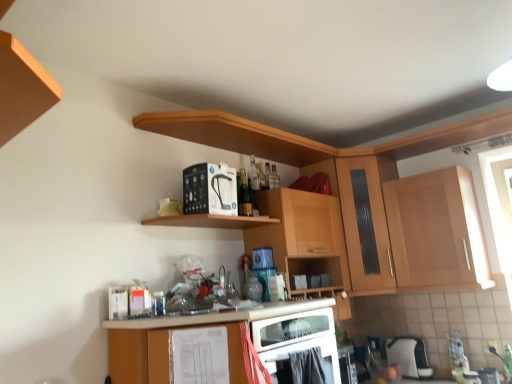
Question: Is wooden cabinet at upper center, arranged as the 2th cabinetry when viewed from the right, turned away from black plastic water filter at upper center, the first appliance viewed from the left?

Choices:
 (A) no
 (B) yes

Answer: (A)

Question: Could you tell me if wooden cabinet at upper center, arranged as the 2th cabinetry when viewed from the right, is facing black plastic water filter at upper center, the 3th appliance viewed from the right?

Choices:
 (A) yes
 (B) no

Answer: (B)

Question: From a real-world perspective, is wooden cabinet at upper center, arranged as the 2th cabinetry when viewed from the right, located beneath black plastic water filter at upper center, the 3th appliance viewed from the right?

Choices:
 (A) yes
 (B) no

Answer: (A)

Question: Considering the relative sizes of wooden cabinet at upper center, arranged as the second cabinetry when viewed from the left, and black plastic water filter at upper center, the first appliance viewed from the left, in the image provided, is wooden cabinet at upper center, arranged as the second cabinetry when viewed from the left, bigger than black plastic water filter at upper center, the first appliance viewed from the left,?

Choices:
 (A) no
 (B) yes

Answer: (B)

Question: Can you confirm if wooden cabinet at upper center, arranged as the second cabinetry when viewed from the left, is positioned to the right of black plastic water filter at upper center, acting as the 3th appliance starting from the bottom?

Choices:
 (A) yes
 (B) no

Answer: (A)

Question: Considering the positions of white plastic toaster at lower right, the 1th appliance from the bottom, and matte wood cabinet at lower center, acting as the 3th cabinetry starting from the right, in the image, is white plastic toaster at lower right, the 1th appliance from the bottom, wider or thinner than matte wood cabinet at lower center, acting as the 3th cabinetry starting from the right,?

Choices:
 (A) wide
 (B) thin

Answer: (B)

Question: In terms of height, does white plastic toaster at lower right, the second appliance from the right, look taller or shorter compared to matte wood cabinet at lower center, acting as the 3th cabinetry starting from the right?

Choices:
 (A) short
 (B) tall

Answer: (A)

Question: Considering the relative positions of white plastic toaster at lower right, which is the first appliance from back to front, and matte wood cabinet at lower center, acting as the 3th cabinetry starting from the right, in the image provided, is white plastic toaster at lower right, which is the first appliance from back to front, to the left or to the right of matte wood cabinet at lower center, acting as the 3th cabinetry starting from the right,?

Choices:
 (A) left
 (B) right

Answer: (B)

Question: Is white plastic toaster at lower right, positioned as the third appliance in front-to-back order, inside the boundaries of matte wood cabinet at lower center, acting as the 3th cabinetry starting from the right, or outside?

Choices:
 (A) inside
 (B) outside

Answer: (B)

Question: In terms of size, does wooden cabinet at upper center, arranged as the 2th cabinetry when viewed from the right, appear bigger or smaller than wooden cabinet at upper right, which is counted as the first cabinetry, starting from the right?

Choices:
 (A) big
 (B) small

Answer: (A)

Question: Is wooden cabinet at upper center, arranged as the 2th cabinetry when viewed from the right, wider or thinner than wooden cabinet at upper right, which is counted as the first cabinetry, starting from the right?

Choices:
 (A) wide
 (B) thin

Answer: (B)

Question: Based on their positions, is wooden cabinet at upper center, arranged as the 2th cabinetry when viewed from the right, located to the left or right of wooden cabinet at upper right, which is counted as the first cabinetry, starting from the right?

Choices:
 (A) left
 (B) right

Answer: (A)

Question: From a real-world perspective, relative to wooden cabinet at upper right, the third cabinetry positioned from the left, is wooden cabinet at upper center, arranged as the 2th cabinetry when viewed from the right, vertically above or below?

Choices:
 (A) above
 (B) below

Answer: (B)

Question: Considering the positions of wooden cabinet at upper right, which is counted as the first cabinetry, starting from the right, and wooden cabinet at upper center, arranged as the 2th cabinetry when viewed from the right, in the image, is wooden cabinet at upper right, which is counted as the first cabinetry, starting from the right, bigger or smaller than wooden cabinet at upper center, arranged as the 2th cabinetry when viewed from the right,?

Choices:
 (A) big
 (B) small

Answer: (B)

Question: In the image, is wooden cabinet at upper right, the third cabinetry positioned from the left, on the left side or the right side of wooden cabinet at upper center, arranged as the 2th cabinetry when viewed from the right?

Choices:
 (A) right
 (B) left

Answer: (A)